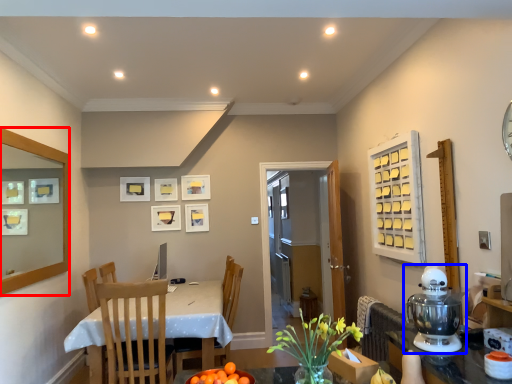
Question: Which of the following is the farthest to the observer, mirror (highlighted by a red box) or mixer (highlighted by a blue box)?

Choices:
 (A) mirror
 (B) mixer

Answer: (A)